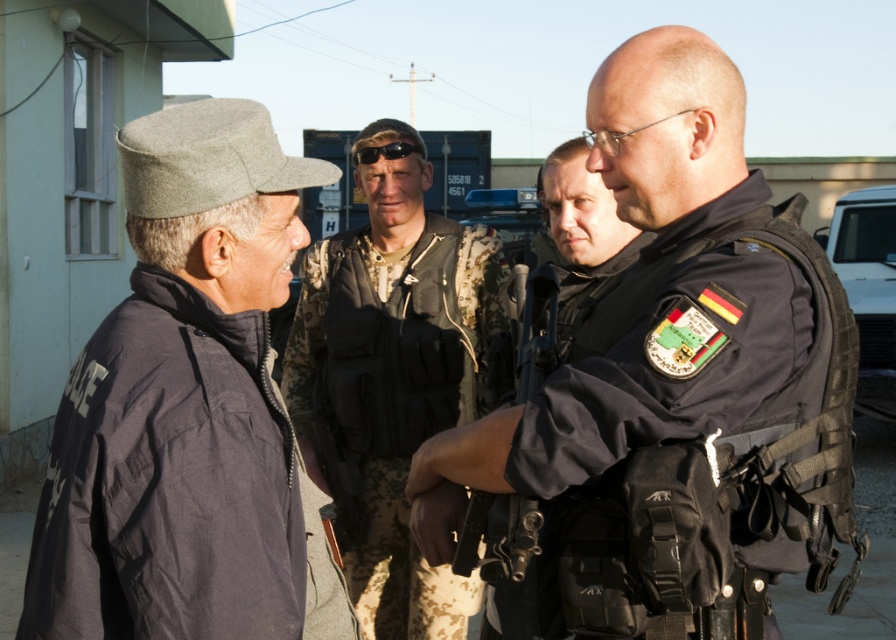
Question: Estimate the real-world distances between objects in this image. Which object is farther from the dark gray woolen hat at left?

Choices:
 (A) black tactical vest at center
 (B) camouflage fabric vest at center

Answer: (B)

Question: Observing the image, what is the correct spatial positioning of black tactical vest at center in reference to dark gray woolen hat at left?

Choices:
 (A) above
 (B) below

Answer: (A)

Question: Can you confirm if black tactical vest at center is thinner than camouflage fabric vest at center?

Choices:
 (A) no
 (B) yes

Answer: (A)

Question: Is black tactical vest at center to the left of camouflage fabric vest at center from the viewer's perspective?

Choices:
 (A) yes
 (B) no

Answer: (B)

Question: Which of the following is the farthest from the observer?

Choices:
 (A) (764, 198)
 (B) (375, 556)
 (C) (135, 618)

Answer: (B)

Question: Which point appears farthest from the camera in this image?

Choices:
 (A) (767, 264)
 (B) (411, 435)
 (C) (191, 380)

Answer: (B)